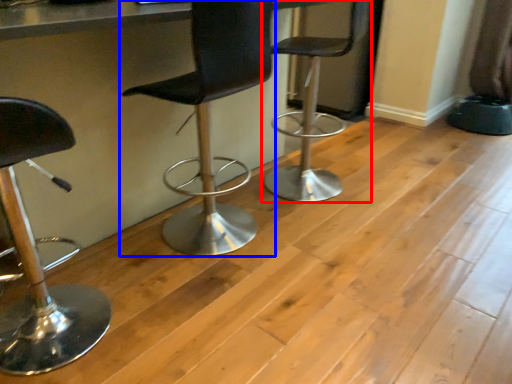
Question: Which object appears closest to the camera in this image, chair (highlighted by a red box) or chair (highlighted by a blue box)?

Choices:
 (A) chair
 (B) chair

Answer: (B)